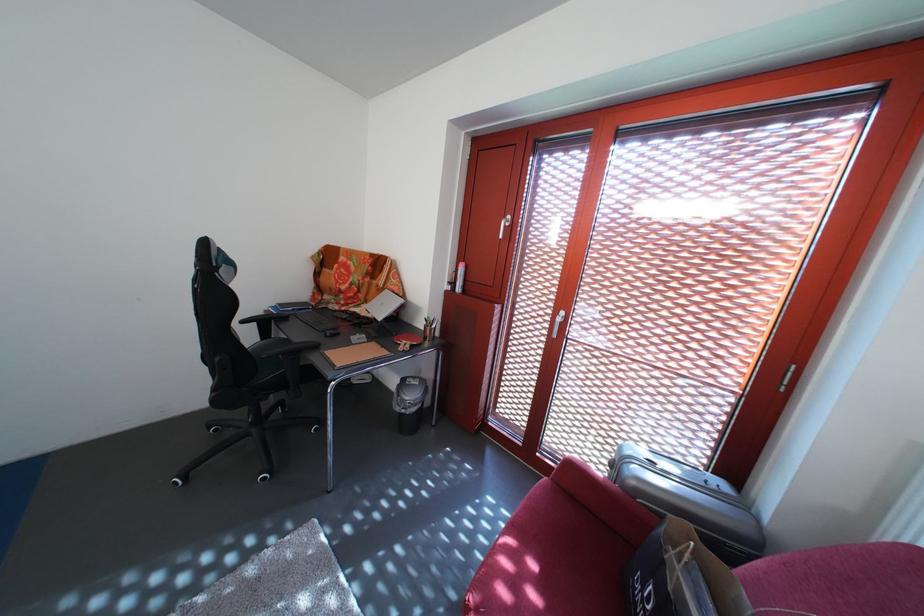
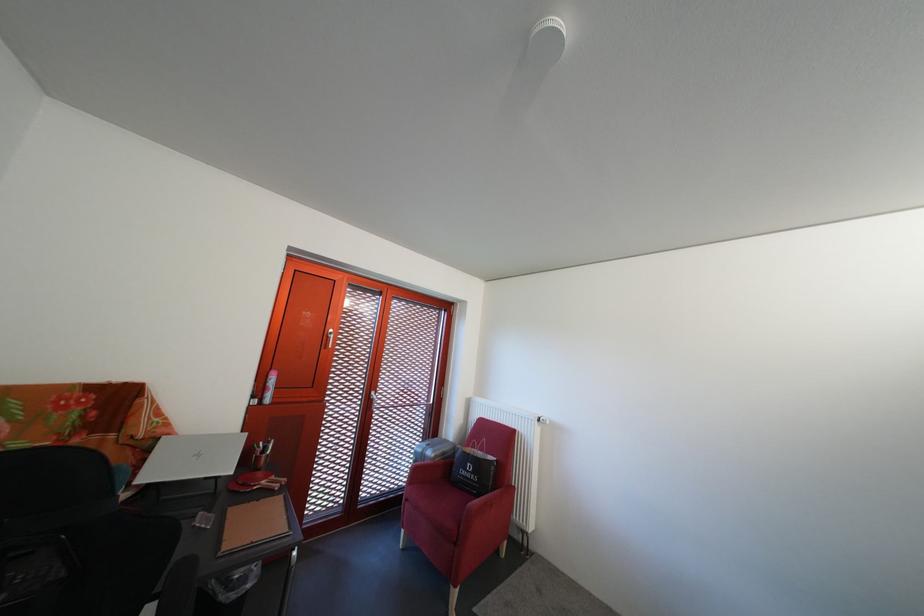
Find the pixel in the second image that matches point (574, 320) in the first image.

(383, 400)